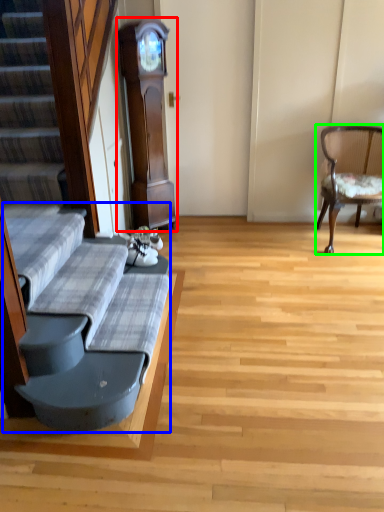
Question: Which object is positioned closest to cabinetry (highlighted by a red box)? Select from couch (highlighted by a blue box) and chair (highlighted by a green box).

Choices:
 (A) couch
 (B) chair

Answer: (B)